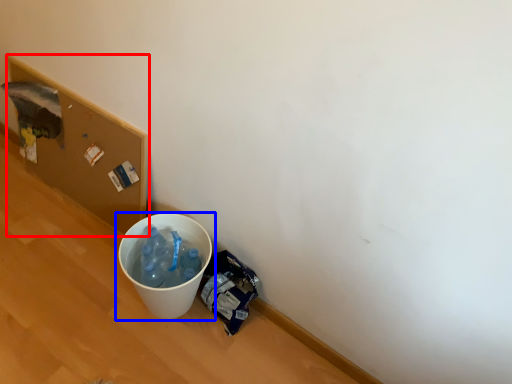
Question: Which of the following is the closest to the observer, cardboard box (highlighted by a red box) or waste container (highlighted by a blue box)?

Choices:
 (A) cardboard box
 (B) waste container

Answer: (B)